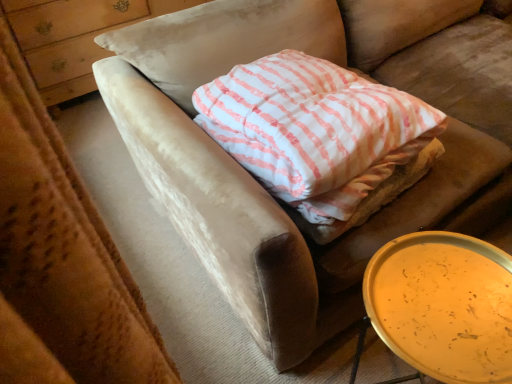
Question: Does white striped fabric pillow at center have a lesser width compared to metallic gold tray at lower right?

Choices:
 (A) yes
 (B) no

Answer: (B)

Question: Is the position of white striped fabric pillow at center more distant than that of metallic gold tray at lower right?

Choices:
 (A) yes
 (B) no

Answer: (A)

Question: Considering the relative sizes of white striped fabric pillow at center and metallic gold tray at lower right in the image provided, is white striped fabric pillow at center shorter than metallic gold tray at lower right?

Choices:
 (A) yes
 (B) no

Answer: (A)

Question: Can you confirm if white striped fabric pillow at center is positioned to the right of metallic gold tray at lower right?

Choices:
 (A) yes
 (B) no

Answer: (B)

Question: Is metallic gold tray at lower right completely or partially inside white striped fabric pillow at center?

Choices:
 (A) no
 (B) yes

Answer: (A)

Question: From a real-world perspective, is white striped fabric pillow at center physically above metallic gold tray at lower right?

Choices:
 (A) no
 (B) yes

Answer: (B)

Question: Does wooden dresser at upper left appear on the right side of white striped fabric pillow at center?

Choices:
 (A) yes
 (B) no

Answer: (B)

Question: Can you confirm if wooden dresser at upper left is thinner than white striped fabric pillow at center?

Choices:
 (A) no
 (B) yes

Answer: (B)

Question: Is wooden dresser at upper left completely or partially outside of white striped fabric pillow at center?

Choices:
 (A) no
 (B) yes

Answer: (B)

Question: From a real-world perspective, is wooden dresser at upper left on white striped fabric pillow at center?

Choices:
 (A) yes
 (B) no

Answer: (B)

Question: From the image's perspective, would you say wooden dresser at upper left is positioned over white striped fabric pillow at center?

Choices:
 (A) yes
 (B) no

Answer: (A)

Question: From a real-world perspective, is wooden dresser at upper left under white striped fabric pillow at center?

Choices:
 (A) no
 (B) yes

Answer: (B)

Question: Is metallic gold tray at lower right at the left side of wooden dresser at upper left?

Choices:
 (A) no
 (B) yes

Answer: (A)